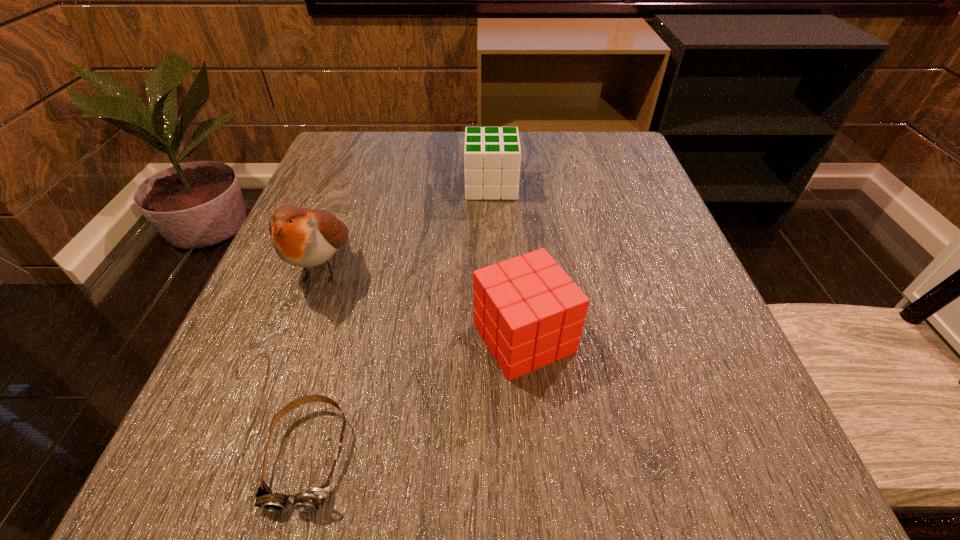
At what (x,y) coordinates should I click in order to perform the action: click on vacant region that satisfies the following two spatial constraints: 1. on the red face of the farthest object; 2. on the back side of the nearer cube. Please return your answer as a coordinate pair (x, y). The width and height of the screenshot is (960, 540). Looking at the image, I should click on (496, 338).